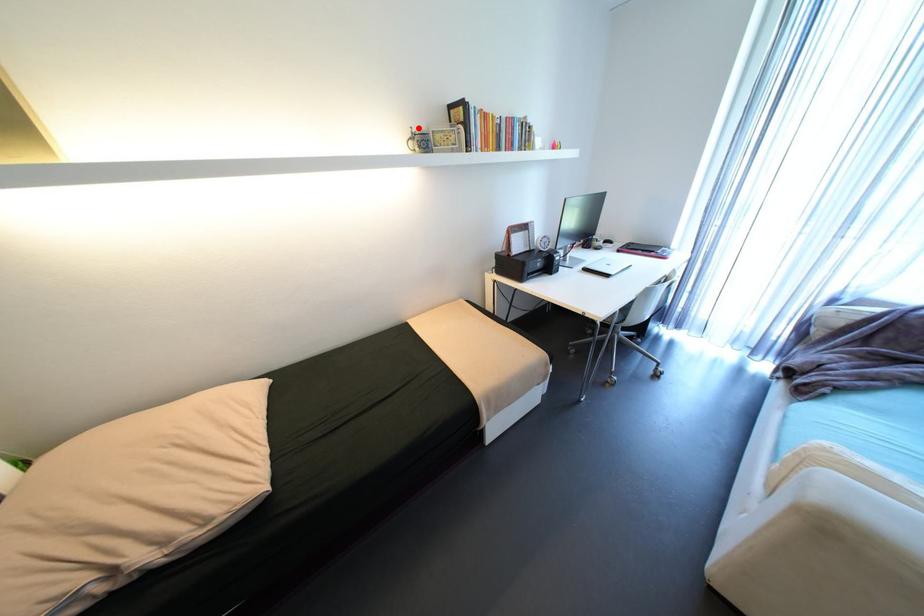
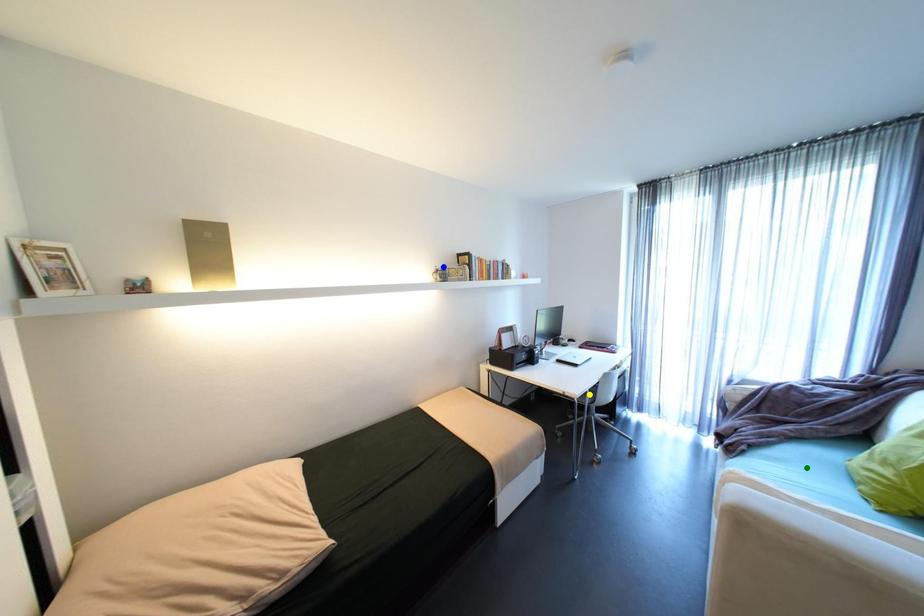
Question: I am providing you with two images of the same scene from different viewpoints. A red point is marked on the first image. You are given multiple points on the second image. In image 2, which mark is for the same physical point as the one in image 1?

Choices:
 (A) yellow point
 (B) blue point
 (C) green point

Answer: (B)